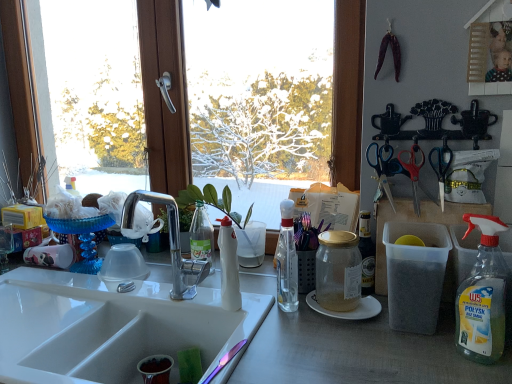
Find the location of `free location in front of gold glass jar at center, acting as the third bottle starting from the left`. free location in front of gold glass jar at center, acting as the third bottle starting from the left is located at coordinates (354, 343).